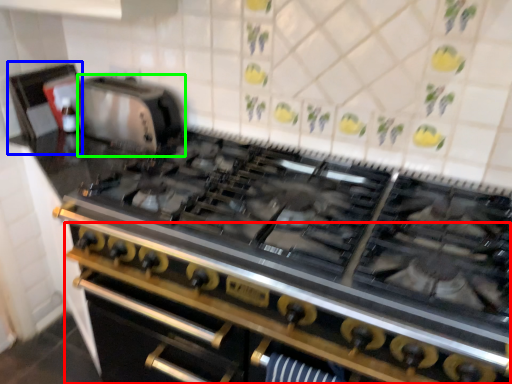
Question: Which object is the closest to the oven (highlighted by a red box)? Choose among these: appliance (highlighted by a blue box) or appliance (highlighted by a green box).

Choices:
 (A) appliance
 (B) appliance

Answer: (B)